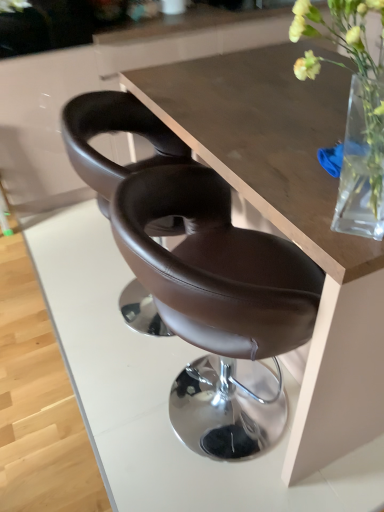
The width and height of the screenshot is (384, 512). In order to click on free spot below translucent glass vase at upper right (from a real-world perspective) in this screenshot , I will do `click(329, 217)`.